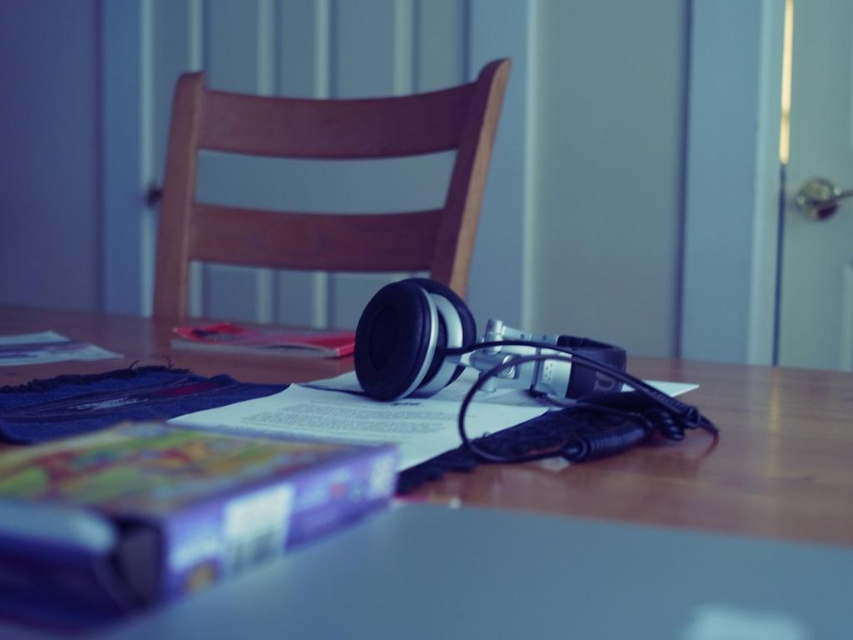
Is matte plastic book at lower left above wooden chair at center?

No, matte plastic book at lower left is not above wooden chair at center.

Identify the location of matte plastic book at lower left. (167, 509).

Does point (604, 506) come farther from viewer compared to point (223, 448)?

Yes, point (604, 506) is behind point (223, 448).

Does wooden table at center have a lesser height compared to matte plastic book at lower left?

No.

Locate an element on the screen. wooden table at center is located at coordinates (590, 538).

Can you confirm if wooden table at center is wider than wooden chair at center?

In fact, wooden table at center might be narrower than wooden chair at center.

In the scene shown: Which is above, wooden table at center or wooden chair at center?

wooden chair at center

Find the location of a particular element. wooden table at center is located at coordinates (590, 538).